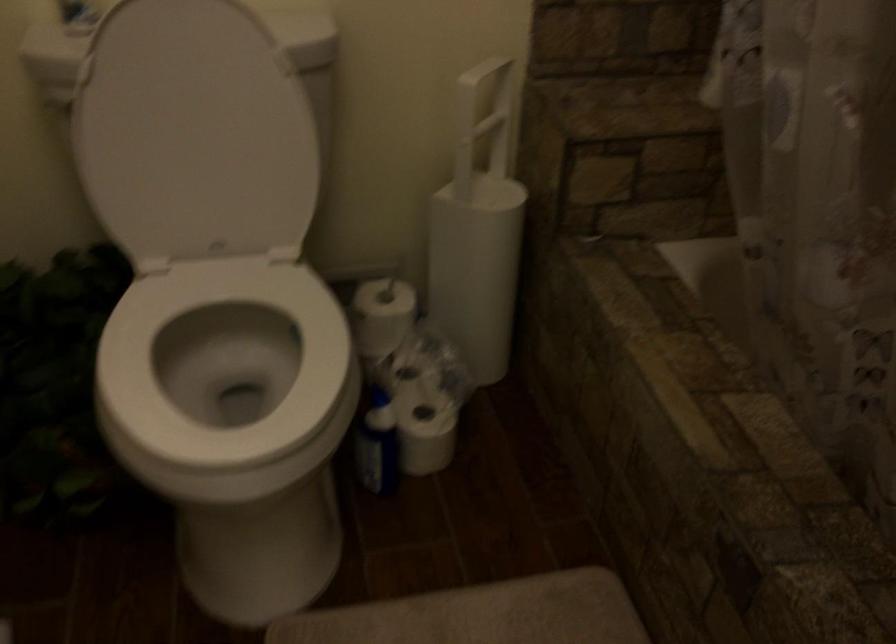
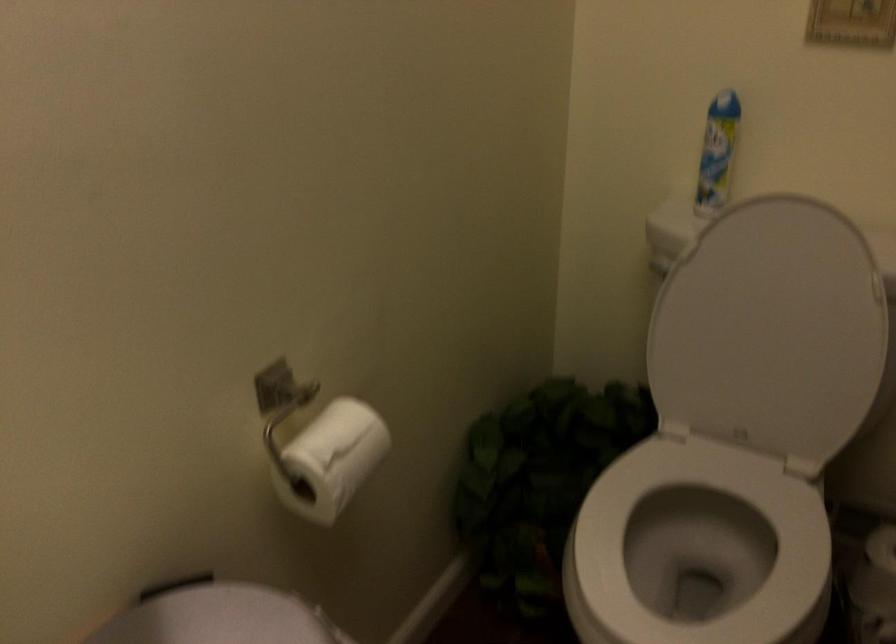
The point at (x=218, y=131) is marked in the first image. Where is the corresponding point in the second image?

(771, 330)